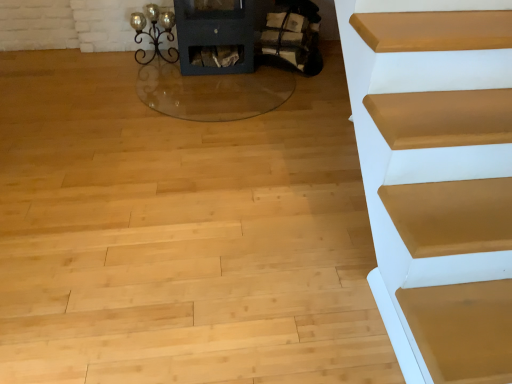
Question: Should I look upward or downward to see wooden logs at center?

Choices:
 (A) up
 (B) down

Answer: (A)

Question: Could you tell me if wooden logs at center is turned towards metallic wrought iron candle holder at upper left?

Choices:
 (A) yes
 (B) no

Answer: (B)

Question: Would you say wooden logs at center is a long distance from metallic wrought iron candle holder at upper left?

Choices:
 (A) yes
 (B) no

Answer: (B)

Question: Is wooden logs at center completely or partially outside of metallic wrought iron candle holder at upper left?

Choices:
 (A) yes
 (B) no

Answer: (A)

Question: Considering the relative sizes of wooden logs at center and metallic wrought iron candle holder at upper left in the image provided, is wooden logs at center smaller than metallic wrought iron candle holder at upper left?

Choices:
 (A) yes
 (B) no

Answer: (B)

Question: Does wooden logs at center have a lesser height compared to metallic wrought iron candle holder at upper left?

Choices:
 (A) yes
 (B) no

Answer: (B)

Question: Is the position of wooden logs at center more distant than that of metallic wrought iron candle holder at upper left?

Choices:
 (A) no
 (B) yes

Answer: (A)

Question: Is metallic wrought iron candle holder at upper left wider than wooden logs at center?

Choices:
 (A) no
 (B) yes

Answer: (A)

Question: Can you confirm if metallic wrought iron candle holder at upper left is thinner than wooden logs at center?

Choices:
 (A) no
 (B) yes

Answer: (B)

Question: Are metallic wrought iron candle holder at upper left and wooden logs at center beside each other?

Choices:
 (A) yes
 (B) no

Answer: (B)

Question: Considering the relative positions of metallic wrought iron candle holder at upper left and wooden logs at center in the image provided, is metallic wrought iron candle holder at upper left to the right of wooden logs at center from the viewer's perspective?

Choices:
 (A) no
 (B) yes

Answer: (A)

Question: From a real-world perspective, is metallic wrought iron candle holder at upper left physically below wooden logs at center?

Choices:
 (A) no
 (B) yes

Answer: (B)

Question: Is metallic wrought iron candle holder at upper left positioned behind wooden logs at center?

Choices:
 (A) yes
 (B) no

Answer: (A)

Question: Considering their positions, is wooden logs at center located in front of or behind metallic wrought iron candle holder at upper left?

Choices:
 (A) behind
 (B) front

Answer: (B)